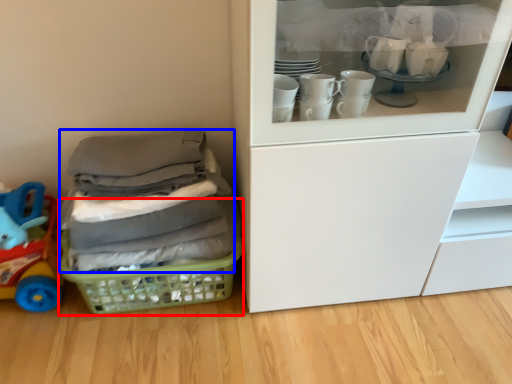
Question: Which of the following is the closest to the observer, basket (highlighted by a red box) or clothing (highlighted by a blue box)?

Choices:
 (A) basket
 (B) clothing

Answer: (B)